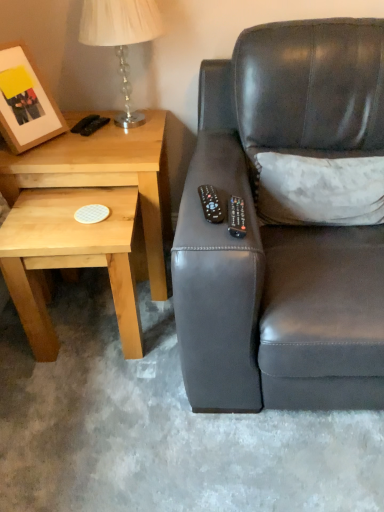
Question: From the image's perspective, is light wood/textureobject at left above or below black plastic remote at upper right, marked as the 1th remote in a right-to-left arrangement?

Choices:
 (A) below
 (B) above

Answer: (B)

Question: In terms of height, does light wood/textureobject at left look taller or shorter compared to black plastic remote at upper right, marked as the 1th remote in a right-to-left arrangement?

Choices:
 (A) tall
 (B) short

Answer: (A)

Question: Estimate the real-world distances between objects in this image. Which object is closer to the black plastic remote at upper right, the 2th remote viewed from the left?

Choices:
 (A) light wood/texture coaster at lower left
 (B) black plastic remote at center, the second remote from the right
 (C) light wood/textureobject at left
 (D) wooden matte picture frame at upper left
 (E) matte black couch at right

Answer: (B)

Question: Which object is the farthest from the translucent glass table lamp at upper left?

Choices:
 (A) matte black couch at right
 (B) black plastic remote at upper right, marked as the 1th remote in a right-to-left arrangement
 (C) black plastic remote at center, positioned as the 1th remote in left-to-right order
 (D) light wood/textureobject at left
 (E) wooden matte picture frame at upper left

Answer: (B)